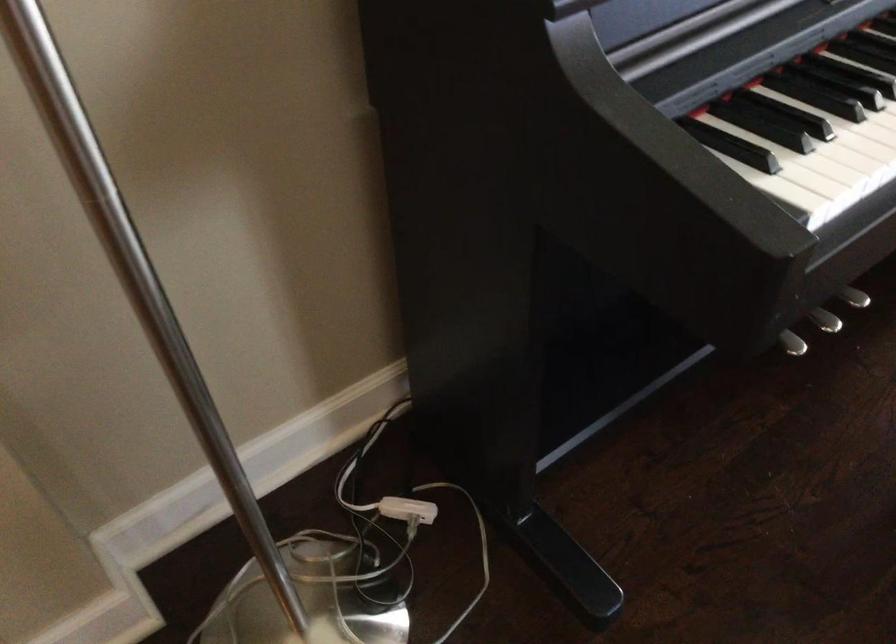
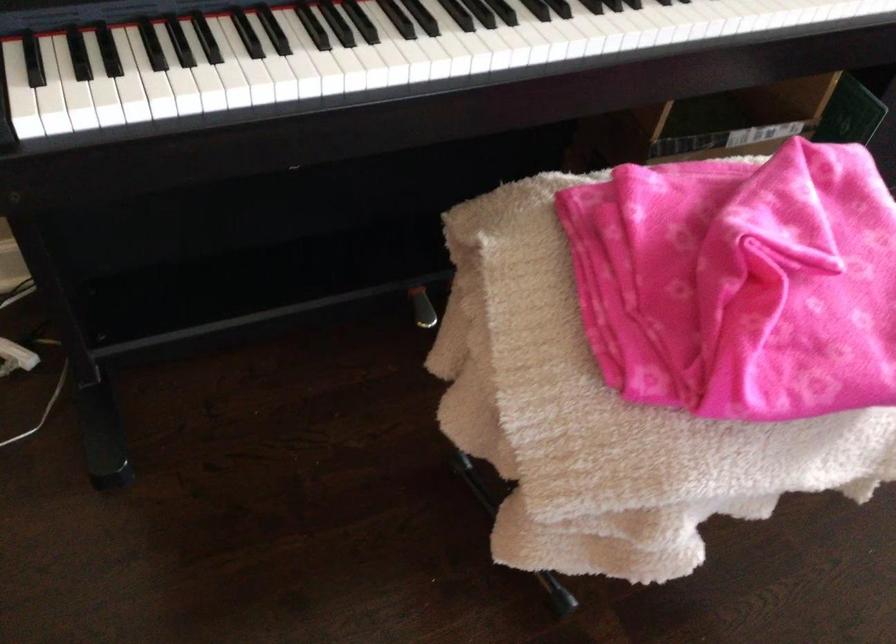
Question: I am providing you with two images of the same scene from different viewpoints. After the viewpoint changes to image2, which objects are now occluded?

Choices:
 (A) silver piano pedal
 (B) white folded blanket
 (C) pink folded blanket
 (D) beige throw pillow

Answer: (A)